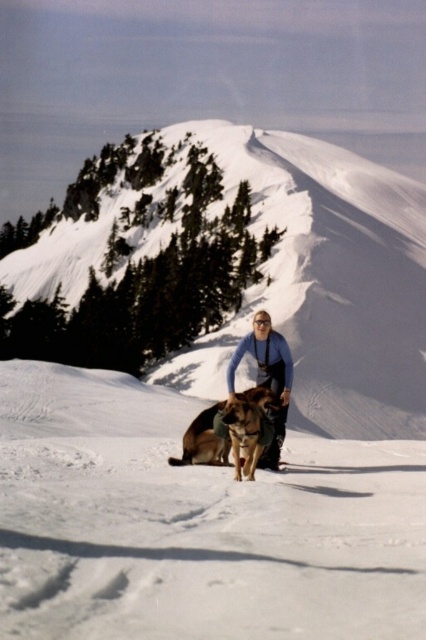
You are a photographer trying to capture the light blue fleece jacket at center and the white fluffy snow at center in the same frame. Which object is closer to the camera?

The light blue fleece jacket at center is closer to the camera because the white fluffy snow at center is positioned under it, indicating it is behind the jacket.

You are planning to take a photo of both the snowy white mountain at center and the brown fur dog at center. Which one would you focus on first if you want to ensure both are in focus?

The snowy white mountain at center is taller than the brown fur dog at center, so you should focus on the snowy white mountain at center first to ensure both are in focus.

You are standing at the point marked by coordinates point (48, 513) and want to take a photo of the entire scene. The camera you are using has a maximum range of 20 meters. Will you be able to capture the entire scene in one shot?

The distance between point (48, 513) and the camera is 17.08 meters, which is within the camera maximum range of 20 meters. Therefore, you can capture the entire scene in one shot.